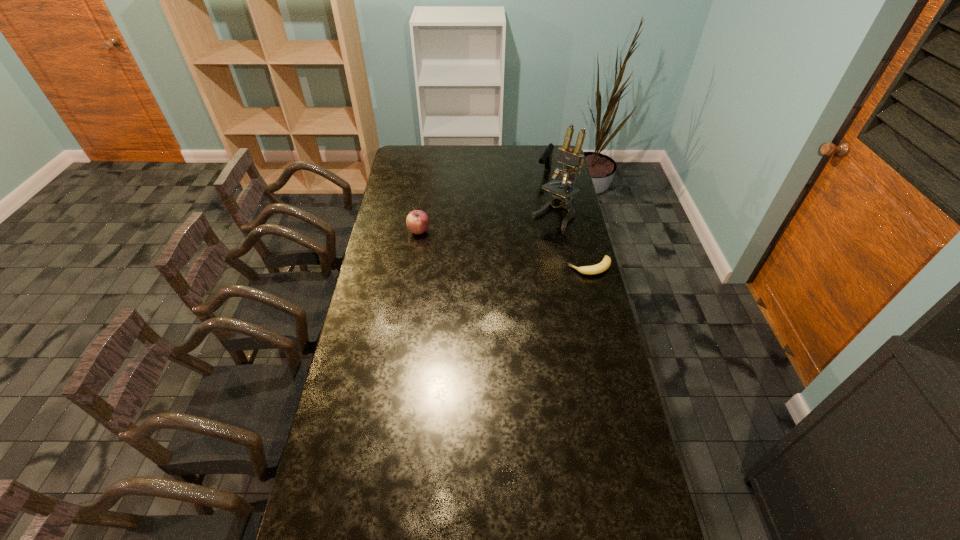
This screenshot has width=960, height=540. What are the coordinates of `object that is at the far right corner` in the screenshot? It's located at (546, 158).

In order to click on free space at the far edge of the desktop in this screenshot , I will do `click(507, 164)`.

In the image, there is a desktop. At what (x,y) coordinates should I click in order to perform the action: click on vacant space at the left edge. Please return your answer as a coordinate pair (x, y). The width and height of the screenshot is (960, 540). Looking at the image, I should click on (376, 400).

You are a GUI agent. You are given a task and a screenshot of the screen. Output one action in this format:
    pyautogui.click(x=<x>, y=<y>)
    Task: Click on the free space at the right edge of the desktop
    The height and width of the screenshot is (540, 960).
    Given the screenshot: What is the action you would take?
    pyautogui.click(x=619, y=434)

In the image, there is a desktop. Find the location of `free space at the far left corner`. free space at the far left corner is located at coordinates (418, 157).

The width and height of the screenshot is (960, 540). I want to click on free region at the near left corner, so [x=336, y=517].

The image size is (960, 540). In the image, there is a desktop. What are the coordinates of `vacant space at the far right corner` in the screenshot? It's located at (x=563, y=163).

You are a GUI agent. You are given a task and a screenshot of the screen. Output one action in this format:
    pyautogui.click(x=<x>, y=<y>)
    Task: Click on the empty location between the apple and the pistol
    This screenshot has height=540, width=960.
    Given the screenshot: What is the action you would take?
    pyautogui.click(x=482, y=202)

You are a GUI agent. You are given a task and a screenshot of the screen. Output one action in this format:
    pyautogui.click(x=<x>, y=<y>)
    Task: Click on the vacant area that lies between the microscope and the second shortest object
    The image size is (960, 540).
    Given the screenshot: What is the action you would take?
    pyautogui.click(x=487, y=223)

You are a GUI agent. You are given a task and a screenshot of the screen. Output one action in this format:
    pyautogui.click(x=<x>, y=<y>)
    Task: Click on the free space between the microscope and the shortest object
    The width and height of the screenshot is (960, 540).
    Given the screenshot: What is the action you would take?
    pyautogui.click(x=572, y=241)